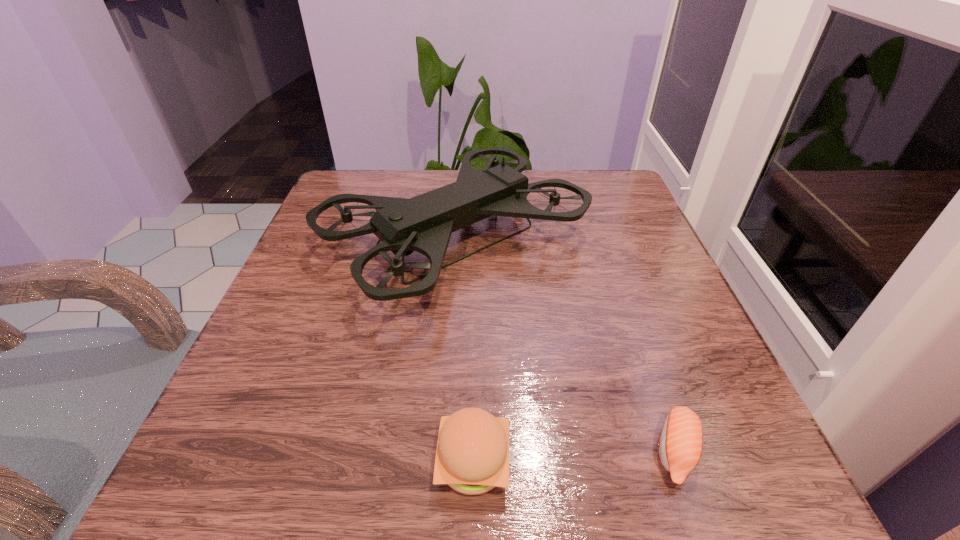
The width and height of the screenshot is (960, 540). I want to click on free space at the far right corner, so click(597, 173).

In the image, there is a desktop. Find the location of `vacant space at the near right corner`. vacant space at the near right corner is located at coordinates (748, 450).

Where is `vacant region between the second tallest object and the sushi`? This screenshot has width=960, height=540. vacant region between the second tallest object and the sushi is located at coordinates (575, 457).

The width and height of the screenshot is (960, 540). I want to click on vacant region between the hamburger and the shortest object, so click(x=575, y=457).

Find the location of `free space between the tallest object and the sushi`. free space between the tallest object and the sushi is located at coordinates (565, 346).

Locate an element on the screen. free point between the sushi and the second shortest object is located at coordinates (575, 457).

At what (x,y) coordinates should I click in order to perform the action: click on free point between the farthest object and the second shortest object. Please return your answer as a coordinate pair (x, y). This screenshot has width=960, height=540. Looking at the image, I should click on (464, 351).

Locate an element on the screen. The width and height of the screenshot is (960, 540). empty space that is in between the tallest object and the hamburger is located at coordinates (464, 351).

This screenshot has width=960, height=540. Identify the location of empty space that is in between the farthest object and the sushi. (565, 346).

Locate an element on the screen. This screenshot has width=960, height=540. empty space that is in between the sushi and the hamburger is located at coordinates (575, 457).